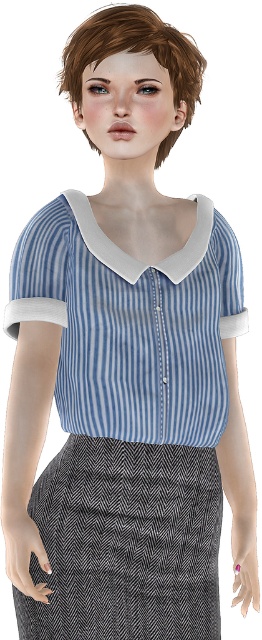
You are standing in front of the person and want to place a small accessory between the two points, point (139, 371) and point (86, 45). Which point should you place it closer to so that it appears in front of both points from your perspective?

You should place the accessory closer to point (139, 371) because it is in front of point (86, 45). This way, the accessory will be positioned in front of both points from your perspective.

You are standing in front of the person wearing the blue and white striped blouse and dark gray pencil skirt. You notice two points on their outfit. The first point is located at coordinates point (106, 442) and the second at point (154, 12). Which point is closer to you?

Point (106, 442) is closer to you because it is further to the viewer than point (154, 12).